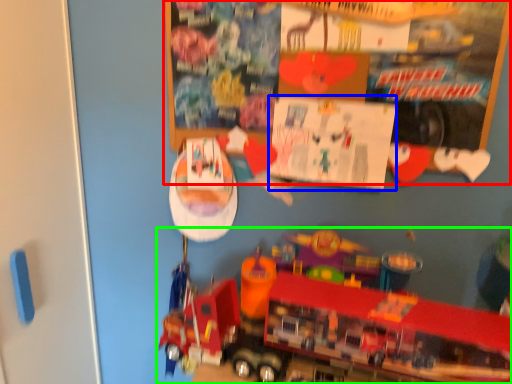
Question: Which object is positioned farthest from bulletin board (highlighted by a red box)? Select from poster page (highlighted by a blue box) and toy (highlighted by a green box).

Choices:
 (A) poster page
 (B) toy

Answer: (B)